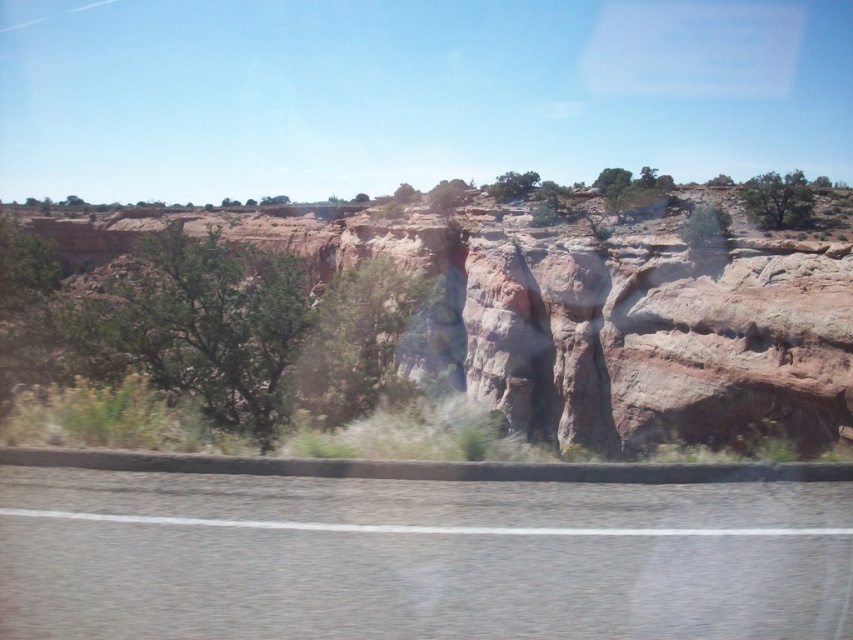
Question: Which point is closer to the camera taking this photo?

Choices:
 (A) (697, 362)
 (B) (152, 490)

Answer: (B)

Question: From the image, what is the correct spatial relationship of gray asphalt highway at lower center in relation to rustic stone cliff at center?

Choices:
 (A) right
 (B) left

Answer: (A)

Question: Does gray asphalt highway at lower center have a larger size compared to rustic stone cliff at center?

Choices:
 (A) yes
 (B) no

Answer: (B)

Question: In this image, where is gray asphalt highway at lower center located relative to rustic stone cliff at center?

Choices:
 (A) below
 (B) above

Answer: (A)